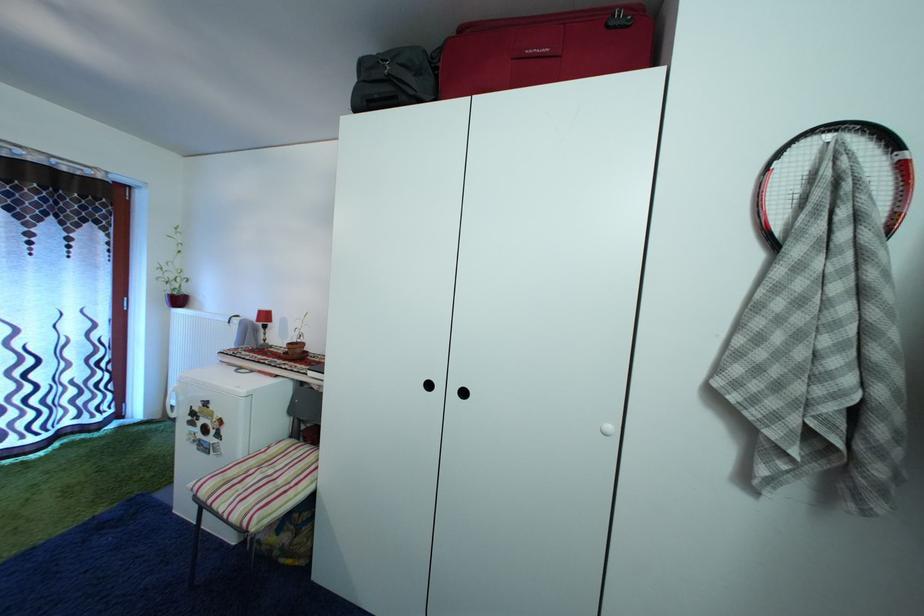
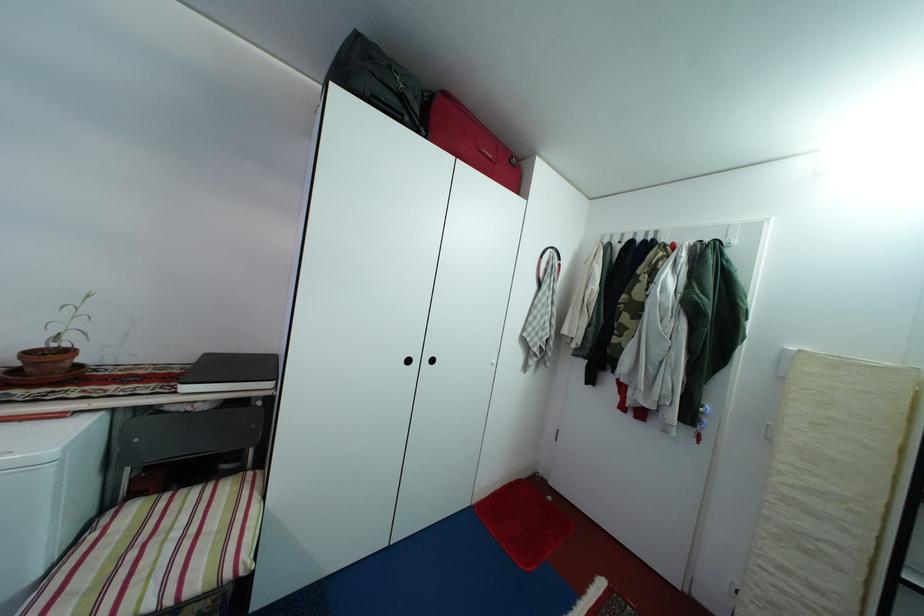
Locate, in the second image, the point that corresponds to pixel 249 464 in the first image.

(47, 581)